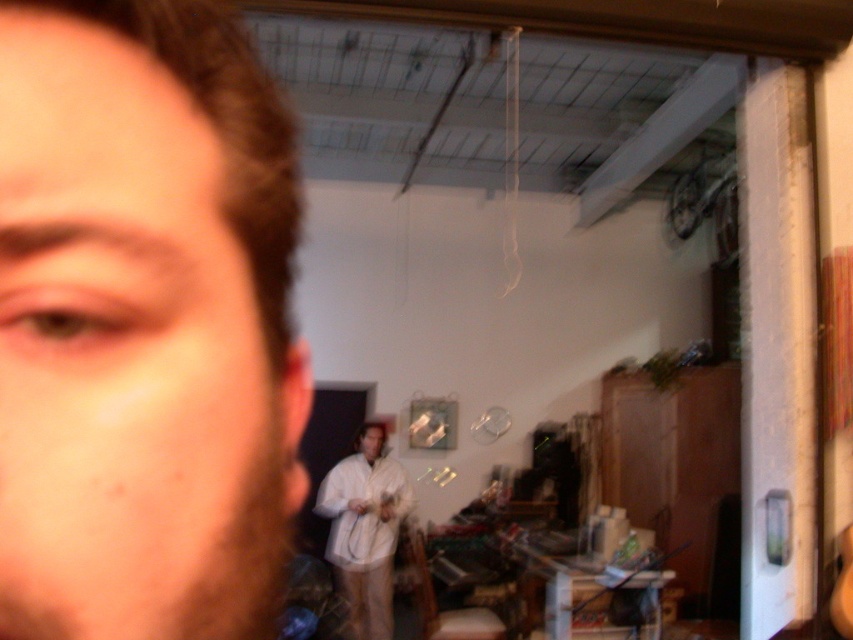
You are an artist trying to paint the scene. You notice the matte skin at center and the white matte shirt at center. Which object should you paint first if you follow the rule of painting from top to bottom?

The matte skin at center should be painted first because it is above the white matte shirt at center.